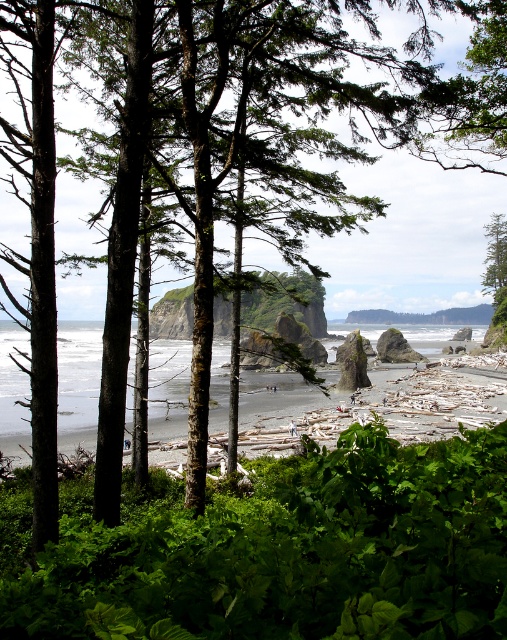
You are an environmental planner designing a walking path through this coastal area. You need to ensure that the path allows visitors to view both the green leafy shrubs at center and the green rough bark tree at upper right. Given their sizes, which object should the path be closer to and why?

The path should be closer to the green leafy shrubs at center because it is smaller than the green rough bark tree at upper right, so visitors will need to be nearer to fully appreciate its details.

You are an environmental scientist assessing the biodiversity of this coastal area. You notice two plants in the scene. Which of the two, the green leafy shrubs at center or the green rough bark tree at upper right, has a smaller trunk or stem diameter?

The green leafy shrubs at center has a smaller trunk or stem diameter than the green rough bark tree at upper right.